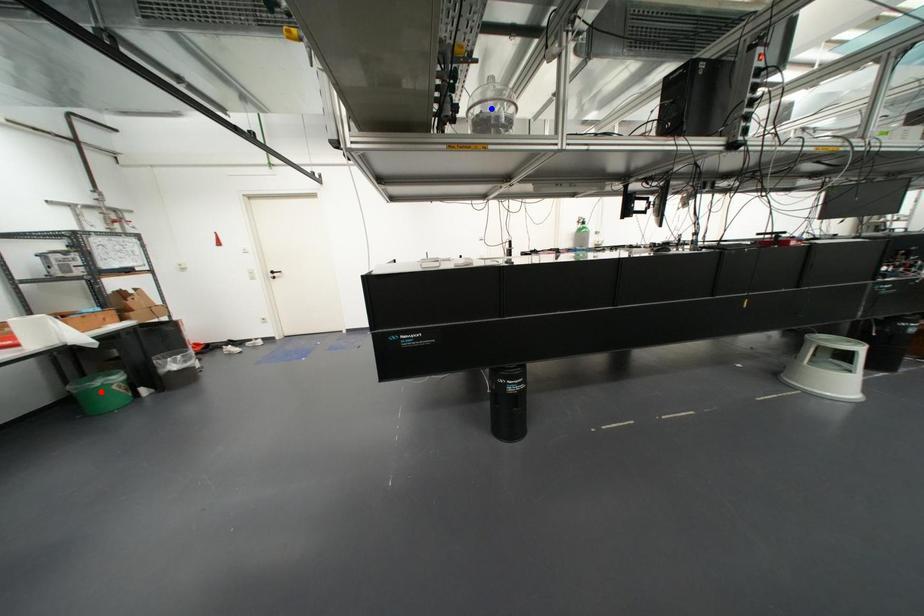
Question: Two points are marked on the image. Which point is closer to the camera?

Choices:
 (A) Blue point is closer.
 (B) Red point is closer.

Answer: (A)